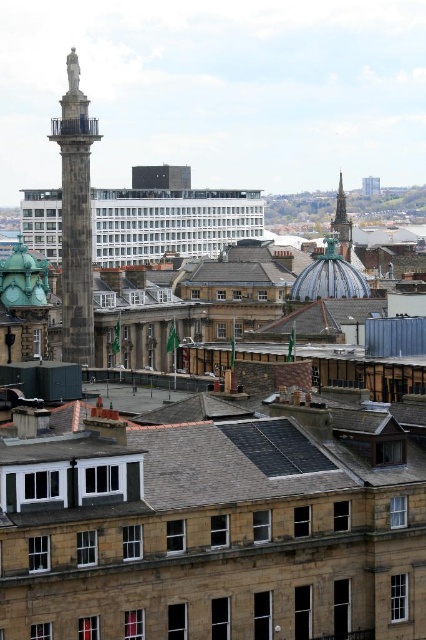
You are an architect analyzing the cityscape. You need to determine if the dark gray slate roof at center can provide a larger surface area for solar panels compared to the dark gray stone column at upper left. Based on their widths, can the roof accommodate more solar panels?

The dark gray slate roof at center might be wider than dark gray stone column at upper left, so it could potentially accommodate more solar panels if the width difference is significant enough to allow for more panel placement.

What are the coordinates of the dark gray slate roof at center?

The dark gray slate roof at center is located at coordinates point [189,467].